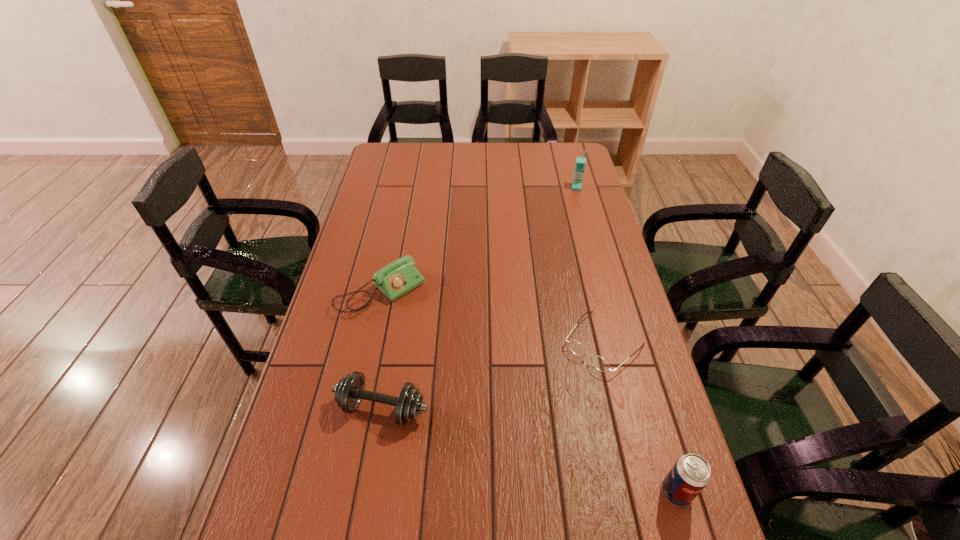
The height and width of the screenshot is (540, 960). I want to click on vacant space located on the dial of the second shortest object, so click(438, 341).

Where is `vacant space located 0.300m on the dial of the second shortest object`? vacant space located 0.300m on the dial of the second shortest object is located at coordinates (473, 375).

The image size is (960, 540). I want to click on blank space located 0.200m on the dial of the second shortest object, so point(449,352).

The width and height of the screenshot is (960, 540). I want to click on free space located 0.180m through the lenses of the spectacles, so click(x=540, y=413).

This screenshot has height=540, width=960. Find the location of `vacant space situated through the lenses of the spectacles`. vacant space situated through the lenses of the spectacles is located at coordinates (553, 400).

This screenshot has height=540, width=960. Identify the location of blank space located through the lenses of the spectacles. (522, 433).

I want to click on free location located on the keypad of the cellular telephone, so click(569, 257).

Where is `blank space located 0.350m on the keypad of the cellular telephone`? The height and width of the screenshot is (540, 960). blank space located 0.350m on the keypad of the cellular telephone is located at coordinates (570, 247).

The height and width of the screenshot is (540, 960). I want to click on vacant space located on the keypad of the cellular telephone, so click(x=570, y=251).

Find the location of a particular element. The width and height of the screenshot is (960, 540). object that is at the near edge is located at coordinates (691, 473).